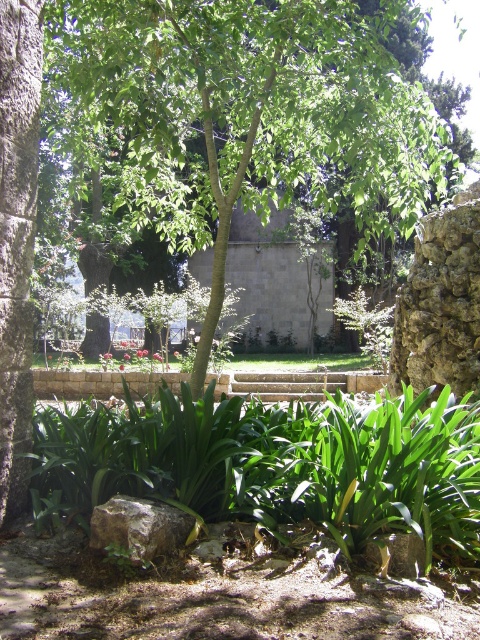
Question: Is the position of green leafy tree at center less distant than that of rusty metallic rock at center?

Choices:
 (A) no
 (B) yes

Answer: (A)

Question: Is green leafy tree at center bigger than rusty metallic rock at center?

Choices:
 (A) no
 (B) yes

Answer: (B)

Question: Which point is farther to the camera?

Choices:
 (A) green leafy tree at center
 (B) rusty metallic rock at center

Answer: (A)

Question: Which of the following is the closest to the observer?

Choices:
 (A) rusty metallic rock at center
 (B) green leafy tree at center

Answer: (A)

Question: Where is green leafy tree at center located in relation to rusty metallic rock at center in the image?

Choices:
 (A) left
 (B) right

Answer: (B)